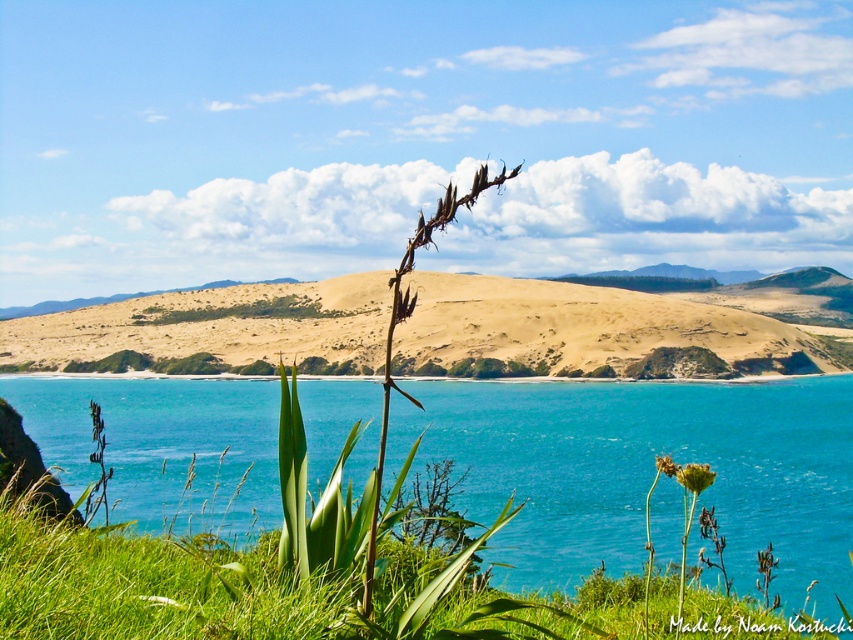
Can you confirm if sandy/dry hillside at center is taller than yellow-green textured flower at center-right?

Correct, sandy/dry hillside at center is much taller as yellow-green textured flower at center-right.

Does sandy/dry hillside at center have a lesser height compared to yellow-green textured flower at center-right?

No.

Is point (791, 328) farther from viewer compared to point (663, 458)?

Yes, it is behind point (663, 458).

In order to click on sandy/dry hillside at center in this screenshot , I will do `click(622, 326)`.

Is sandy/dry hillside at center taller than yellow matte flower at center?

Yes, sandy/dry hillside at center is taller than yellow matte flower at center.

Does sandy/dry hillside at center have a lesser height compared to yellow matte flower at center?

No, sandy/dry hillside at center is not shorter than yellow matte flower at center.

Locate an element on the screen. sandy/dry hillside at center is located at coordinates (622, 326).

Is turquoise water at center in front of yellow matte flower at center?

No, it is behind yellow matte flower at center.

This screenshot has height=640, width=853. What are the coordinates of `turquoise water at center` in the screenshot? It's located at (645, 472).